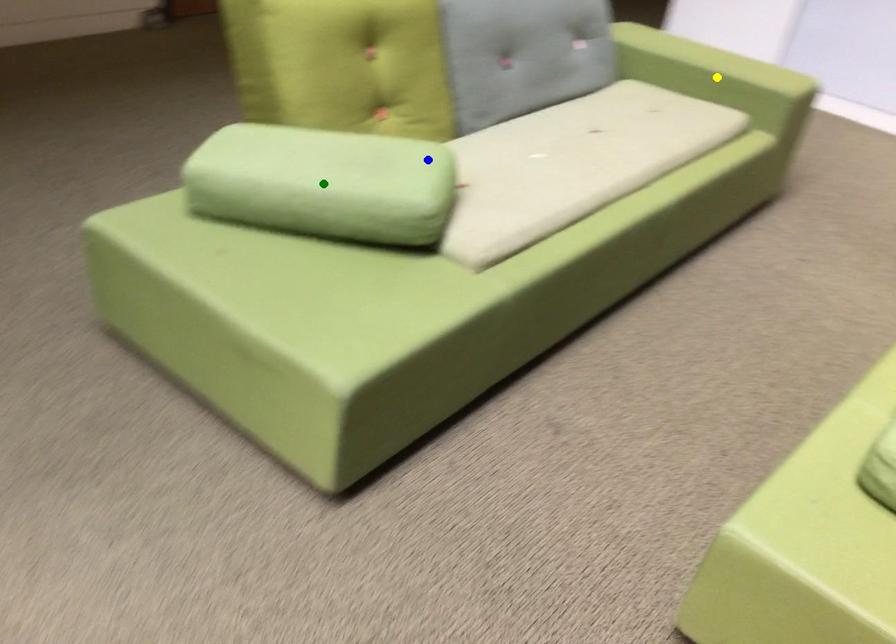
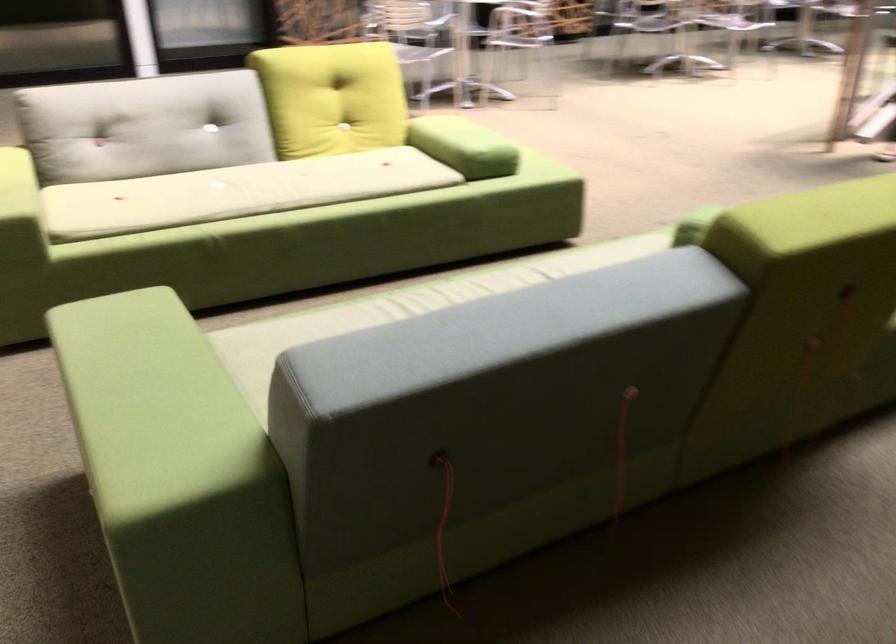
I am providing you with two images of the same scene from different viewpoints. Three points are marked in image1. Which point corresponds to a part or object that is occluded in image2?In image1, three points are marked. Which of them correspond to a part or object that is occluded in image2?Among the three points shown in image1, which one corresponds to a part or object that is no longer visible due to occlusion in image2?

yellow point, green point cannot be seen in image2.